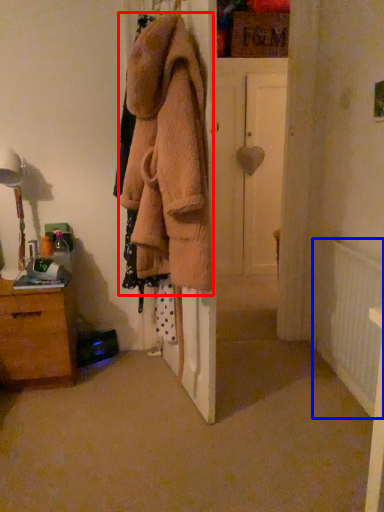
Question: Which point is closer to the camera, clothing (highlighted by a red box) or radiator (highlighted by a blue box)?

Choices:
 (A) clothing
 (B) radiator

Answer: (A)